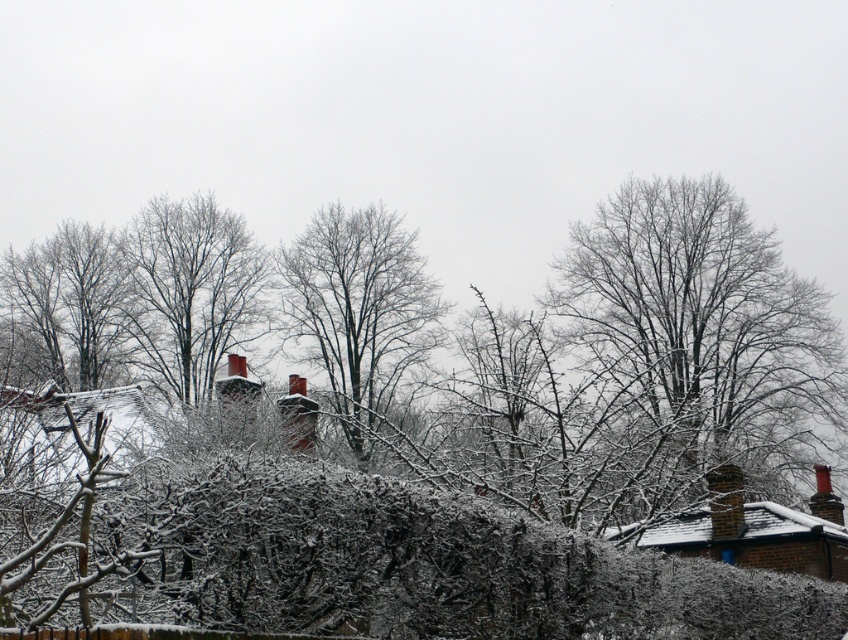
Question: Estimate the real-world distances between objects in this image. Which object is closer to the bare branches at upper right?

Choices:
 (A) bare wood tree at center
 (B) bare branches at center

Answer: (B)

Question: Estimate the real-world distances between objects in this image. Which object is closer to the bare wood tree at center?

Choices:
 (A) bare branches at upper right
 (B) bare branches at center

Answer: (B)

Question: Is the position of bare branches at upper right more distant than that of bare branches at center?

Choices:
 (A) yes
 (B) no

Answer: (B)

Question: Considering the real-world distances, which object is closest to the bare branches at upper right?

Choices:
 (A) bare branches at center
 (B) bare wood tree at center

Answer: (A)

Question: Is bare branches at center thinner than bare wood tree at center?

Choices:
 (A) yes
 (B) no

Answer: (A)

Question: Does bare branches at upper right have a smaller size compared to bare branches at center?

Choices:
 (A) yes
 (B) no

Answer: (B)